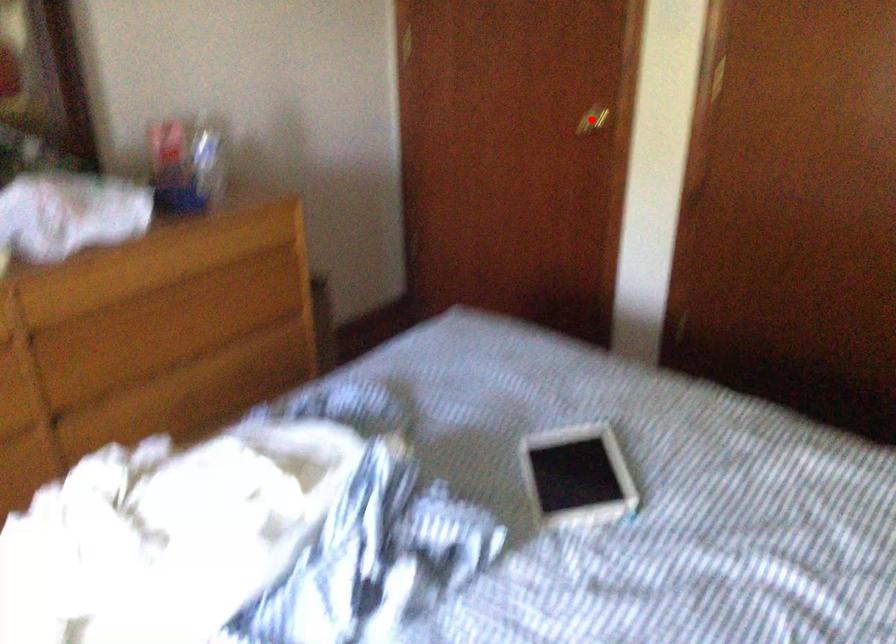
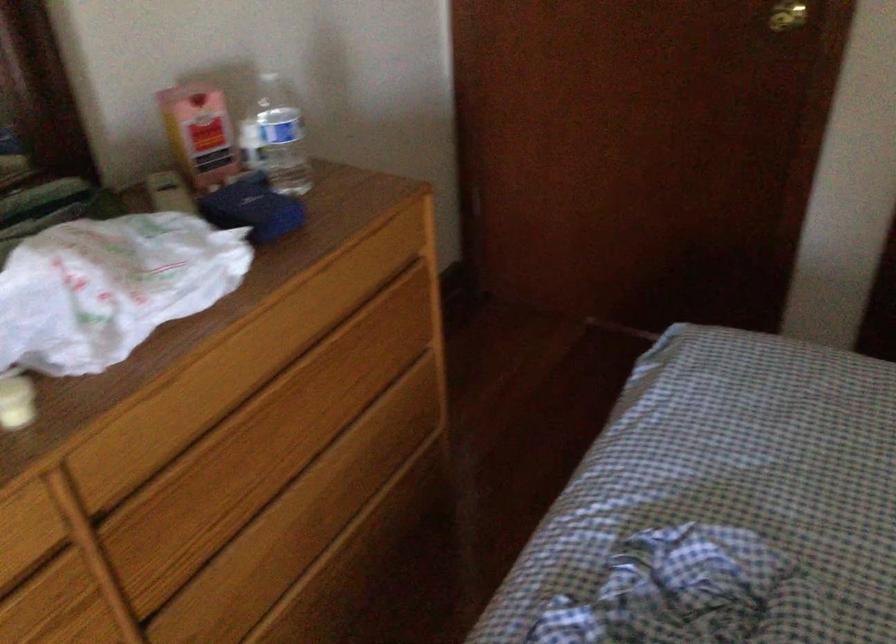
Locate, in the second image, the point that corresponds to the highlighted location in the first image.

(787, 15)